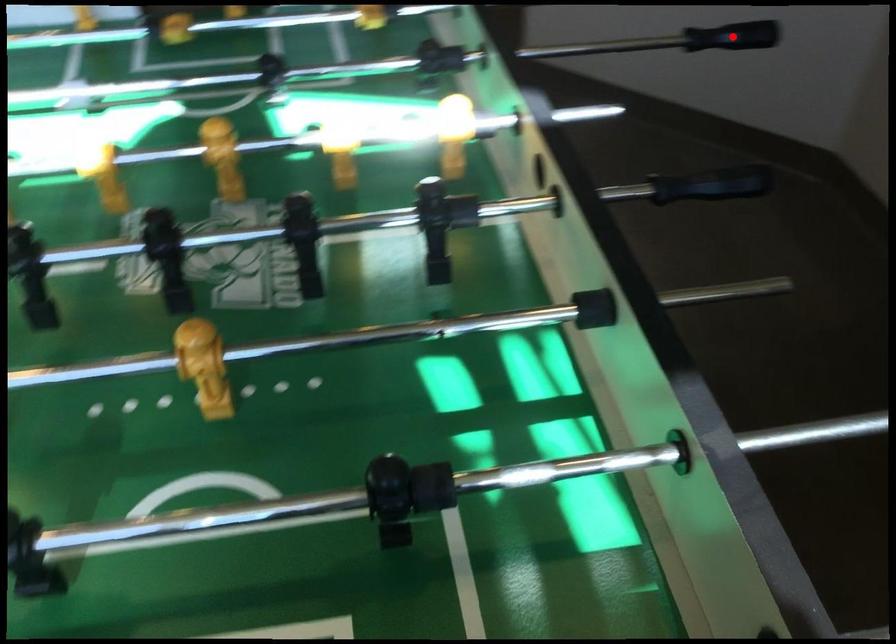
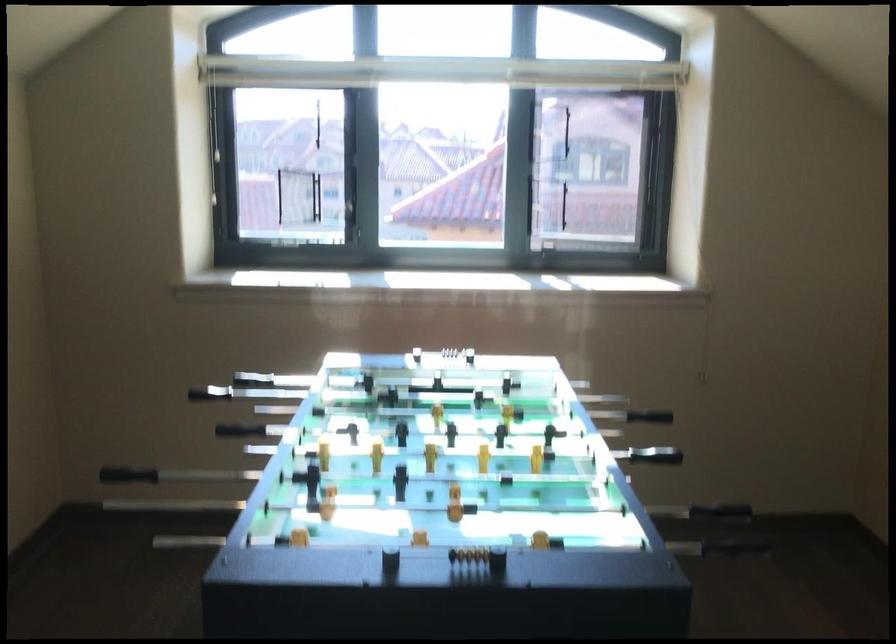
Question: I am providing you with two images of the same scene from different viewpoints. A red point is shown in image1. For the corresponding object point in image2, is it positioned nearer or farther from the camera?

Choices:
 (A) Nearer
 (B) Farther

Answer: (B)